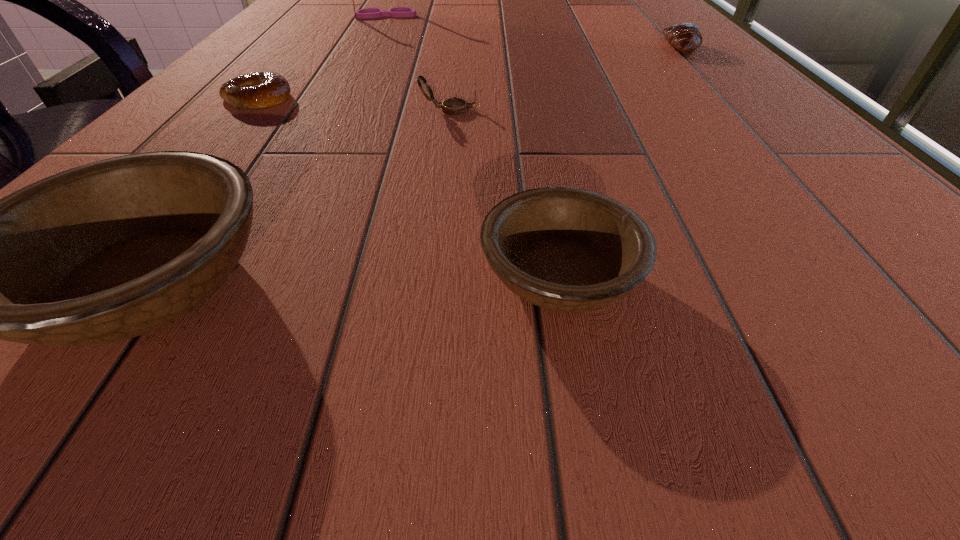
Locate an element on the screen. free point located on the back of the bagel is located at coordinates (280, 72).

At what (x,y) coordinates should I click in order to perform the action: click on vacant space located 0.240m on the face of the third object from right to left. Please return your answer as a coordinate pair (x, y). The width and height of the screenshot is (960, 540). Looking at the image, I should click on (640, 110).

Find the location of a particular element. This screenshot has height=540, width=960. free point located on the right of the farthest object is located at coordinates (444, 16).

This screenshot has height=540, width=960. I want to click on object at the near edge, so click(x=565, y=249).

Locate an element on the screen. The width and height of the screenshot is (960, 540). object at the left edge is located at coordinates (262, 89).

At what (x,y) coordinates should I click in order to perform the action: click on object that is positioned at the right edge. Please return your answer as a coordinate pair (x, y). The width and height of the screenshot is (960, 540). Looking at the image, I should click on pyautogui.click(x=686, y=37).

Image resolution: width=960 pixels, height=540 pixels. I want to click on vacant region at the near edge of the desktop, so click(x=319, y=280).

The image size is (960, 540). What are the coordinates of `vacant space at the left edge of the desktop` in the screenshot? It's located at [301, 5].

In the image, there is a desktop. Where is `vacant space at the right edge`? Image resolution: width=960 pixels, height=540 pixels. vacant space at the right edge is located at coordinates (605, 12).

What are the coordinates of `free point between the shorter bowl and the crescent roll` in the screenshot? It's located at (621, 161).